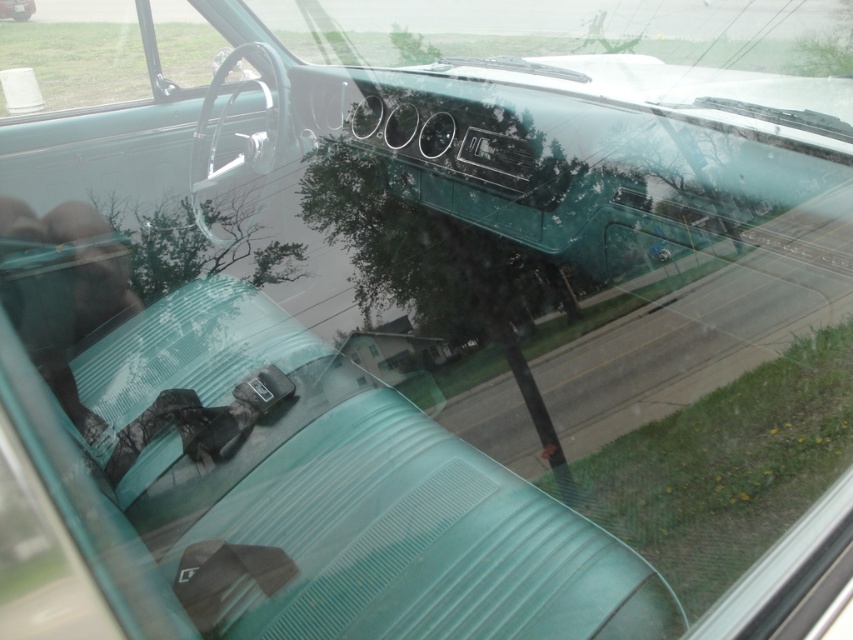
Question: Does clear glass windshield at upper center lie behind clear glass window at upper left?

Choices:
 (A) no
 (B) yes

Answer: (A)

Question: Which point is farther to the camera?

Choices:
 (A) clear glass windshield at upper center
 (B) transparent glass window at center

Answer: (B)

Question: Which point is farther to the camera?

Choices:
 (A) (397, 1)
 (B) (148, 81)

Answer: (A)

Question: Does clear glass window at upper left appear on the right side of transparent glass window at center?

Choices:
 (A) no
 (B) yes

Answer: (A)

Question: From the image, what is the correct spatial relationship of clear glass window at upper left in relation to transparent glass window at center?

Choices:
 (A) left
 (B) right

Answer: (A)

Question: Which object is closer to the camera taking this photo?

Choices:
 (A) transparent glass window at center
 (B) clear glass windshield at upper center
 (C) clear glass window at upper left

Answer: (B)